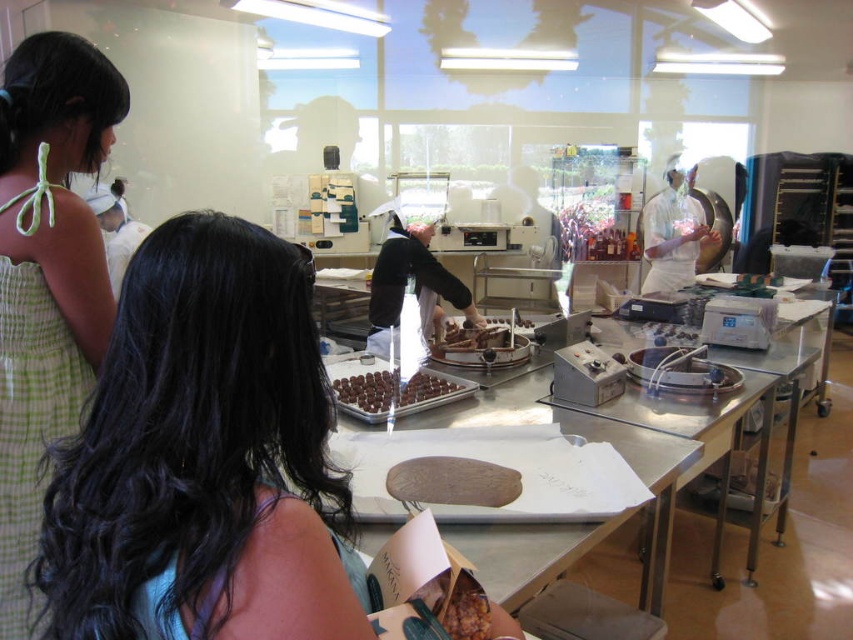
Is point (201, 220) more distant than point (466, 362)?

No.

Can you confirm if smooth black hair at center is positioned above chocolate matte chocolate at center?

Actually, smooth black hair at center is below chocolate matte chocolate at center.

Where is `smooth black hair at center`? The image size is (853, 640). smooth black hair at center is located at coordinates (206, 458).

Which is below, smooth black hair at center or chocolate matte truffles at center?

chocolate matte truffles at center is below.

Locate an element on the screen. This screenshot has width=853, height=640. smooth black hair at center is located at coordinates (206, 458).

Which is behind, point (155, 576) or point (366, 374)?

The point (366, 374) is more distant.

Locate an element on the screen. smooth black hair at center is located at coordinates (206, 458).

Does chocolate matte truffles at center have a greater width compared to chocolate matte chocolate at center?

Yes.

Does chocolate matte truffles at center appear on the left side of chocolate matte chocolate at center?

Correct, you'll find chocolate matte truffles at center to the left of chocolate matte chocolate at center.

The width and height of the screenshot is (853, 640). What do you see at coordinates (396, 392) in the screenshot?
I see `chocolate matte truffles at center` at bounding box center [396, 392].

I want to click on chocolate matte truffles at center, so click(396, 392).